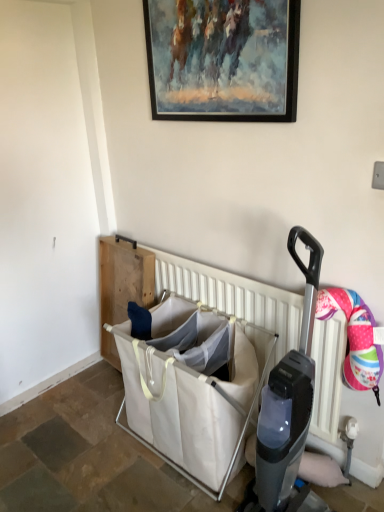
What do you see at coordinates (192, 393) in the screenshot?
I see `white canvas laundry basket at center` at bounding box center [192, 393].

I want to click on white plastic radiator at center, so click(234, 297).

How distant is painted wood picture frame at upper center from white plastic radiator at center?

The distance of painted wood picture frame at upper center from white plastic radiator at center is 32.12 inches.

Does painted wood picture frame at upper center appear on the left side of white plastic radiator at center?

Correct, you'll find painted wood picture frame at upper center to the left of white plastic radiator at center.

Between point (163, 74) and point (282, 300), which one is positioned behind?

Positioned behind is point (163, 74).

Considering the sizes of painted wood picture frame at upper center and white plastic radiator at center in the image, is painted wood picture frame at upper center taller or shorter than white plastic radiator at center?

painted wood picture frame at upper center is shorter than white plastic radiator at center.

Where is `baby carriage that is below the white plastic radiator at center (from the image's perspective)`? baby carriage that is below the white plastic radiator at center (from the image's perspective) is located at coordinates (192, 393).

Is white canvas laundry basket at center in contact with white plastic radiator at center?

No.

Between white canvas laundry basket at center and white plastic radiator at center, which one has smaller width?

With smaller width is white plastic radiator at center.

How far apart are white canvas laundry basket at center and white plastic radiator at center?

white canvas laundry basket at center is 11.59 inches away from white plastic radiator at center.

Is white canvas laundry basket at center inside white plastic radiator at center?

No, white plastic radiator at center does not contain white canvas laundry basket at center.

Between white plastic radiator at center and white canvas laundry basket at center, which one has more height?

With more height is white plastic radiator at center.

Considering the points (177, 290) and (242, 340), which point is in front, point (177, 290) or point (242, 340)?

Point (242, 340)

Which object is more forward, white plastic radiator at center or white canvas laundry basket at center?

white canvas laundry basket at center is more forward.

At what (x,y) coordinates should I click in order to perform the action: click on baby carriage lying below the painted wood picture frame at upper center (from the image's perspective). Please return your answer as a coordinate pair (x, y). The height and width of the screenshot is (512, 384). Looking at the image, I should click on (192, 393).

From the image's perspective, which one is positioned lower, painted wood picture frame at upper center or white canvas laundry basket at center?

white canvas laundry basket at center, from the image's perspective.

Can you see painted wood picture frame at upper center touching white canvas laundry basket at center?

No, painted wood picture frame at upper center is not in contact with white canvas laundry basket at center.

From a real-world perspective, does white canvas laundry basket at center stand above painted wood picture frame at upper center?

Actually, white canvas laundry basket at center is physically below painted wood picture frame at upper center in the real world.

Is painted wood picture frame at upper center inside white canvas laundry basket at center?

No, painted wood picture frame at upper center is not surrounded by white canvas laundry basket at center.

Are white canvas laundry basket at center and painted wood picture frame at upper center far apart?

white canvas laundry basket at center is far away from painted wood picture frame at upper center.

How many degrees apart are the facing directions of white plastic radiator at center and painted wood picture frame at upper center?

white plastic radiator at center and painted wood picture frame at upper center are facing 0.431 degrees away from each other.

Considering the positions of objects white plastic radiator at center and painted wood picture frame at upper center in the image provided, who is behind, white plastic radiator at center or painted wood picture frame at upper center?

Positioned behind is white plastic radiator at center.

From the image's perspective, is white plastic radiator at center above or below painted wood picture frame at upper center?

white plastic radiator at center is below painted wood picture frame at upper center.

Is white plastic radiator at center oriented towards painted wood picture frame at upper center?

No, white plastic radiator at center is not facing towards painted wood picture frame at upper center.

Identify the location of picture frame lying on the left of white plastic radiator at center. Image resolution: width=384 pixels, height=512 pixels. (223, 59).

You are a GUI agent. You are given a task and a screenshot of the screen. Output one action in this format:
    pyautogui.click(x=<x>, y=<y>)
    Task: Click on the radiator above the white canvas laundry basket at center (from the image's perspective)
    The image size is (384, 512).
    Given the screenshot: What is the action you would take?
    [234, 297]

Estimate the real-world distances between objects in this image. Which object is further from white canvas laundry basket at center, painted wood picture frame at upper center or white plastic radiator at center?

painted wood picture frame at upper center lies further to white canvas laundry basket at center than the other object.

Which object lies nearer to the anchor point white canvas laundry basket at center, white plastic radiator at center or painted wood picture frame at upper center?

Based on the image, white plastic radiator at center appears to be nearer to white canvas laundry basket at center.

Estimate the real-world distances between objects in this image. Which object is further from painted wood picture frame at upper center, white canvas laundry basket at center or white plastic radiator at center?

white canvas laundry basket at center is further to painted wood picture frame at upper center.

When comparing their distances from white plastic radiator at center, does painted wood picture frame at upper center or white canvas laundry basket at center seem closer?

Based on the image, white canvas laundry basket at center appears to be nearer to white plastic radiator at center.

Looking at the image, which one is located further to painted wood picture frame at upper center, white plastic radiator at center or white canvas laundry basket at center?

The object further to painted wood picture frame at upper center is white canvas laundry basket at center.

Which object lies further to the anchor point white plastic radiator at center, white canvas laundry basket at center or painted wood picture frame at upper center?

Among the two, painted wood picture frame at upper center is located further to white plastic radiator at center.

Locate an element on the screen. Image resolution: width=384 pixels, height=512 pixels. radiator between painted wood picture frame at upper center and white canvas laundry basket at center in the vertical direction is located at coordinates (234, 297).